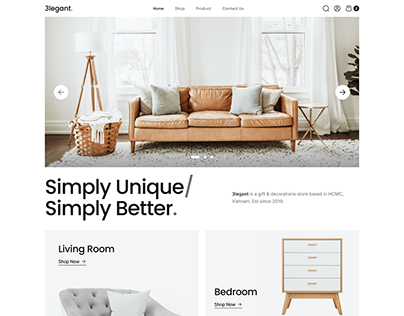
At what (x,y) coordinates should I click in order to perform the action: click on curtains. Please return your answer as a coordinate pair (x, y). Looking at the image, I should click on (103, 59), (163, 72), (250, 74), (316, 62).